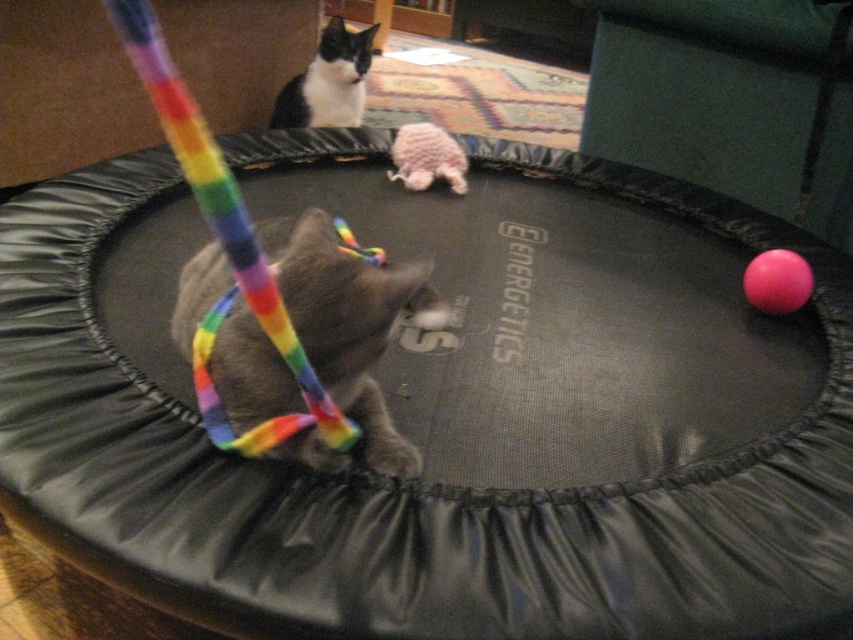
You are a cat on the trampoline and you want to grab the pink rubber ball at right. Which direction should you move to reach it from the fuzzy pink toy at center?

The pink rubber ball at right is behind the fuzzy pink toy at center, so you should move backward to reach it.

You are a cat owner who wants to ensure your pets have enough space to play. You see the black and white fur cat at upper center and the pink rubber ball at right. Which object takes up more space in the image?

The black and white fur cat at upper center takes up more space in the image because it has a larger size compared to the pink rubber ball at right.